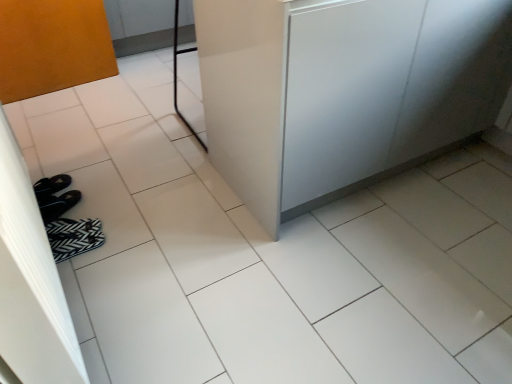
Question: From the image's perspective, is matte orange screen door at left positioned above or below black fabric flip-flops at lower left?

Choices:
 (A) above
 (B) below

Answer: (A)

Question: Considering the positions of matte orange screen door at left and black fabric flip-flops at lower left in the image, is matte orange screen door at left taller or shorter than black fabric flip-flops at lower left?

Choices:
 (A) short
 (B) tall

Answer: (B)

Question: Which object is positioned farthest from the matte orange screen door at left?

Choices:
 (A) black fabric flip-flops at lower left
 (B) satin white counter at center

Answer: (B)

Question: Estimate the real-world distances between objects in this image. Which object is closer to the satin white counter at center?

Choices:
 (A) black fabric flip-flops at lower left
 (B) matte orange screen door at left

Answer: (B)